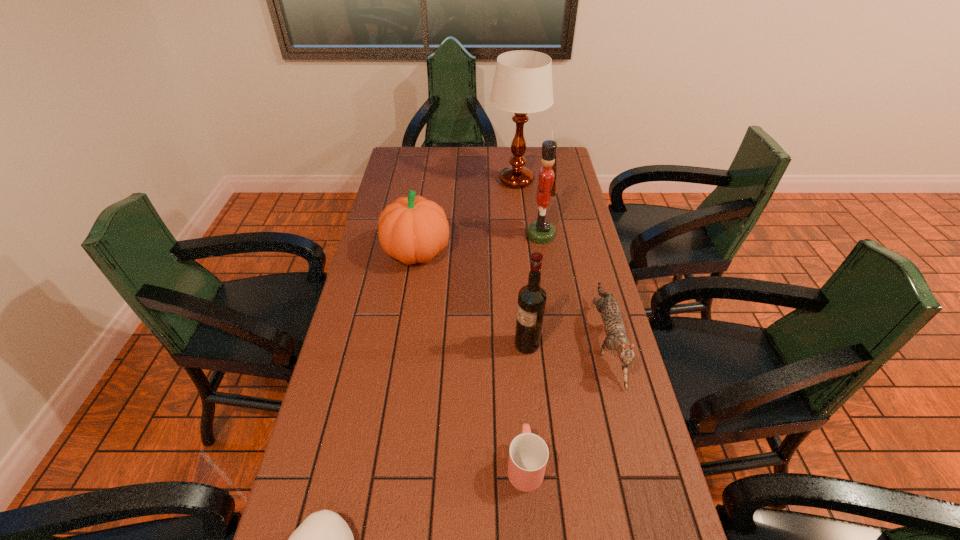
Where is `object that is positioned at the far edge`? object that is positioned at the far edge is located at coordinates (522, 84).

This screenshot has height=540, width=960. Find the location of `object that is at the left edge`. object that is at the left edge is located at coordinates (412, 229).

The width and height of the screenshot is (960, 540). What are the coordinates of `table lamp that is at the right edge` in the screenshot? It's located at (522, 84).

This screenshot has width=960, height=540. I want to click on nutcracker present at the right edge, so pos(542,232).

Find the location of a particular element. This screenshot has width=960, height=540. cat at the right edge is located at coordinates (617, 339).

In order to click on object at the far right corner in this screenshot , I will do (522, 84).

In the image, there is a desktop. Where is `vacant space at the far edge`? This screenshot has height=540, width=960. vacant space at the far edge is located at coordinates (448, 147).

Image resolution: width=960 pixels, height=540 pixels. Find the location of `vacant space at the left edge of the desktop`. vacant space at the left edge of the desktop is located at coordinates (402, 177).

The image size is (960, 540). What are the coordinates of `vacant region at the right edge of the desktop` in the screenshot? It's located at (579, 381).

This screenshot has width=960, height=540. In the image, there is a desktop. Find the location of `vacant space at the far left corner`. vacant space at the far left corner is located at coordinates (422, 172).